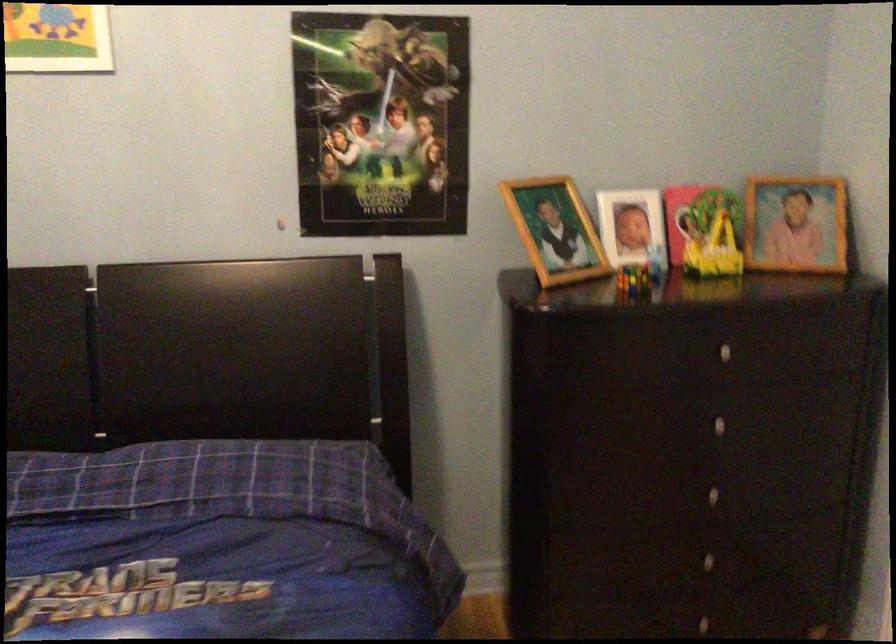
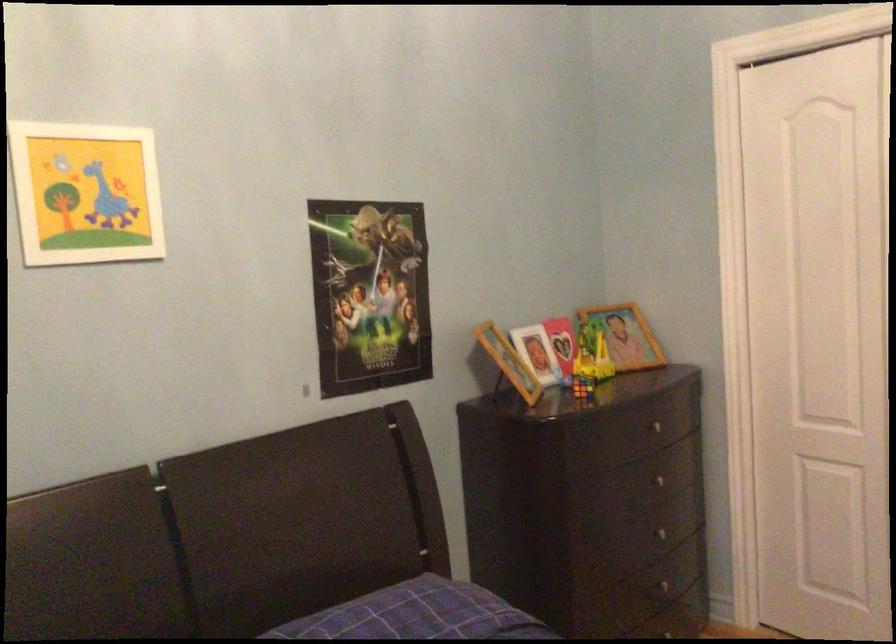
In the second image, find the point that corresponds to (x=711, y=415) in the first image.

(656, 480)